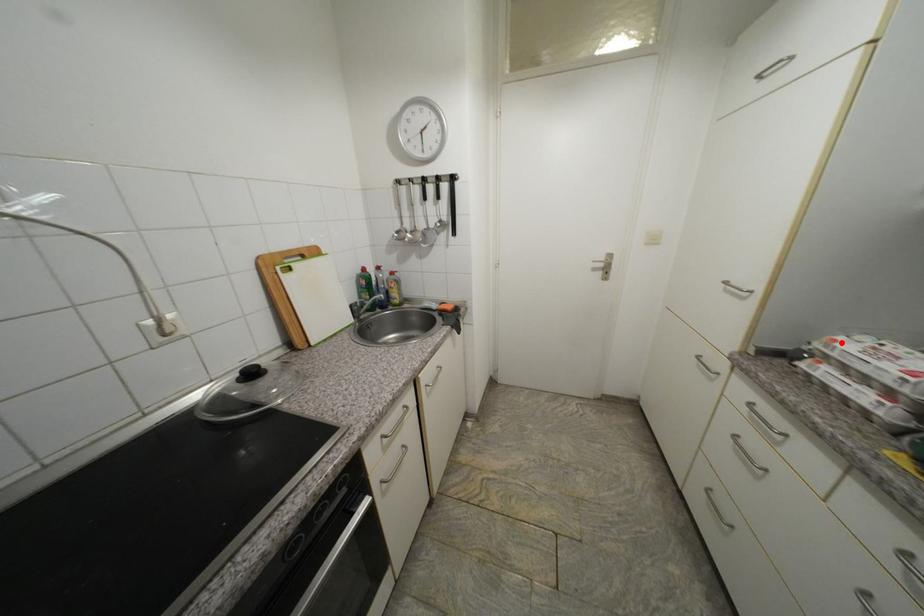
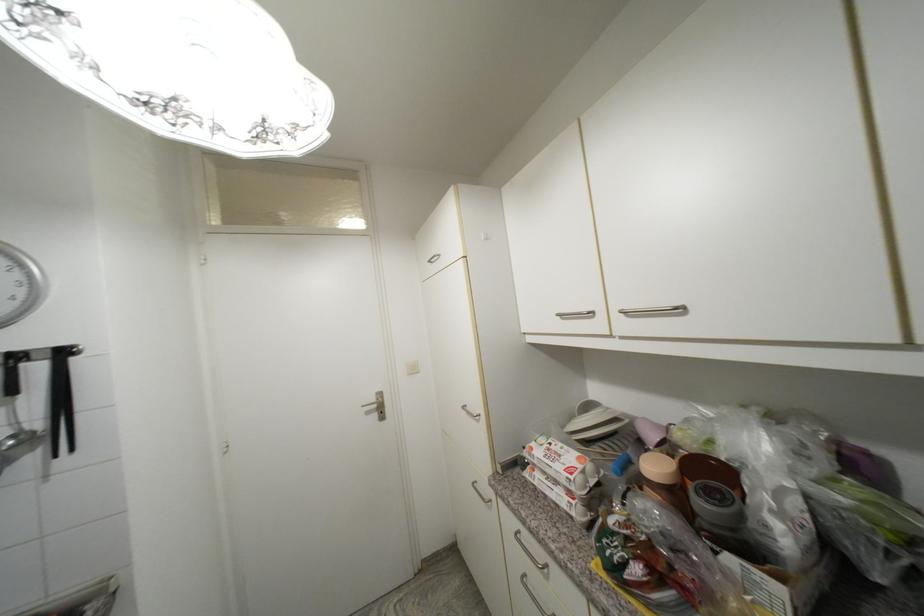
Locate, in the second image, the point that corresponds to the highlighted location in the first image.

(537, 451)